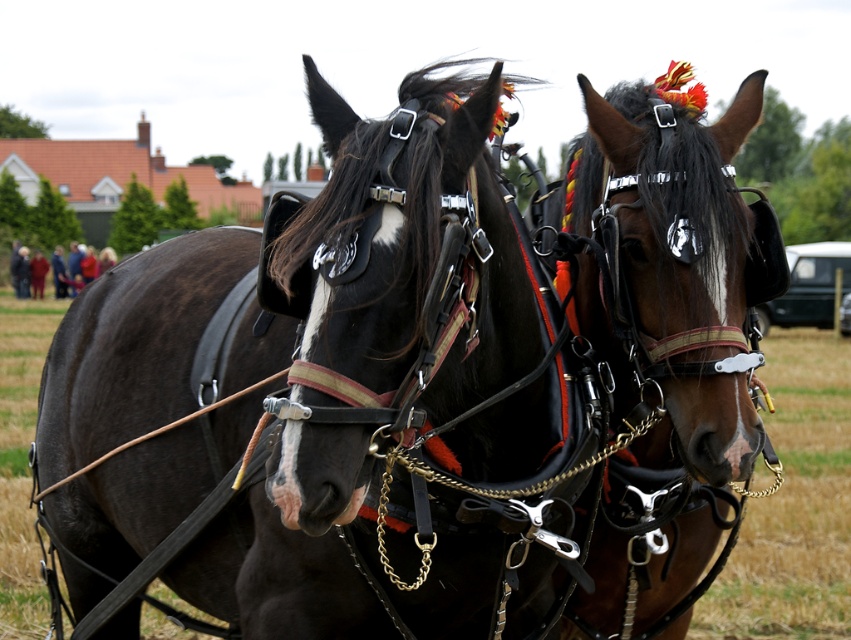
You are a farmer who needs to attach a new harness to the shiny brown horse at center and the red wool coat at left. Based on their positions, which horse should you approach first to ensure you don

The shiny brown horse at center is positioned on the right side of the red wool coat at left, so you should approach the red wool coat at left first since it is closer to your starting position on the left side of the image.

You are a farmer who needs to secure the shiny brown horse at center and the red wool coat at left in a stable. Given that the stable is 40 meters long, will both items fit inside without overlapping?

The distance between the shiny brown horse at center and the red wool coat at left is 37.62 meters, which is less than the stable length of 40 meters. Therefore, both items can fit inside the stable without overlapping.

You are a farmer checking the equipment. You notice the shiny black harness at center and the shiny brown horse at center. Which object is positioned to the left?

The shiny black harness at center is to the left of the shiny brown horse at center.